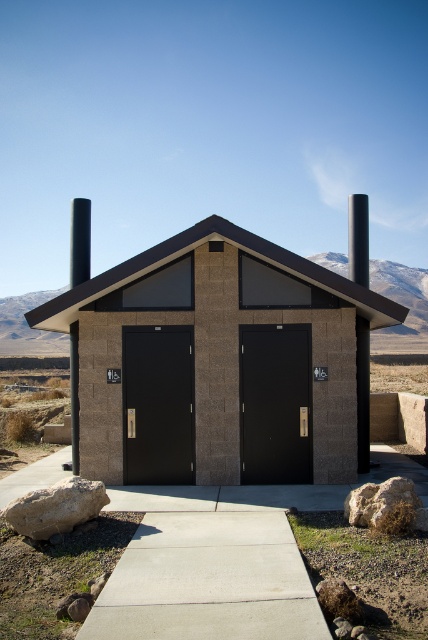
You are standing in front of the restroom facility and want to enter through the black matte door at center. Which direction should you look to see the brown textured concrete hut at center?

The brown textured concrete hut at center is located above the black matte door at center, so you should look upward to see it.

You are standing in front of the restroom facility and notice two doors labeled as matte black door at center and black matte door at center. Which door is closer to you?

The matte black door at center is closer to you since it is in front of the black matte door at center.